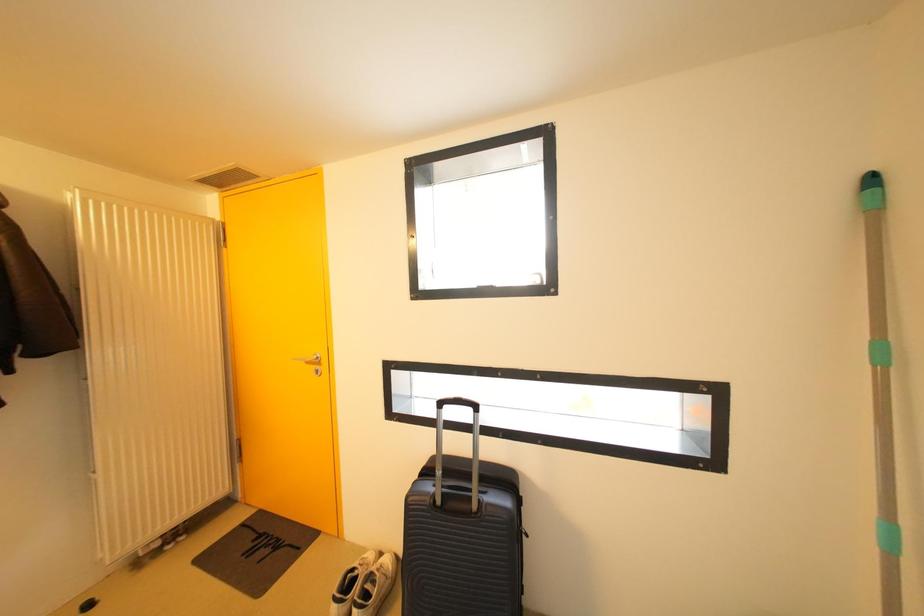
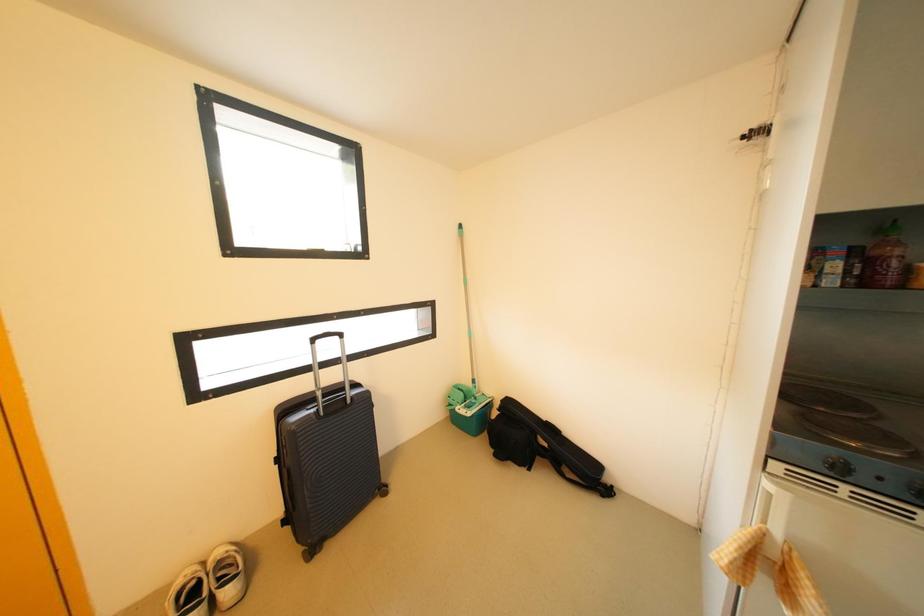
Question: The camera is either moving clockwise (left) or counter-clockwise (right) around the object. The first image is from the beginning of the video and the second image is from the end. Is the camera moving left or right when shooting the video?

Choices:
 (A) Left
 (B) Right

Answer: (A)